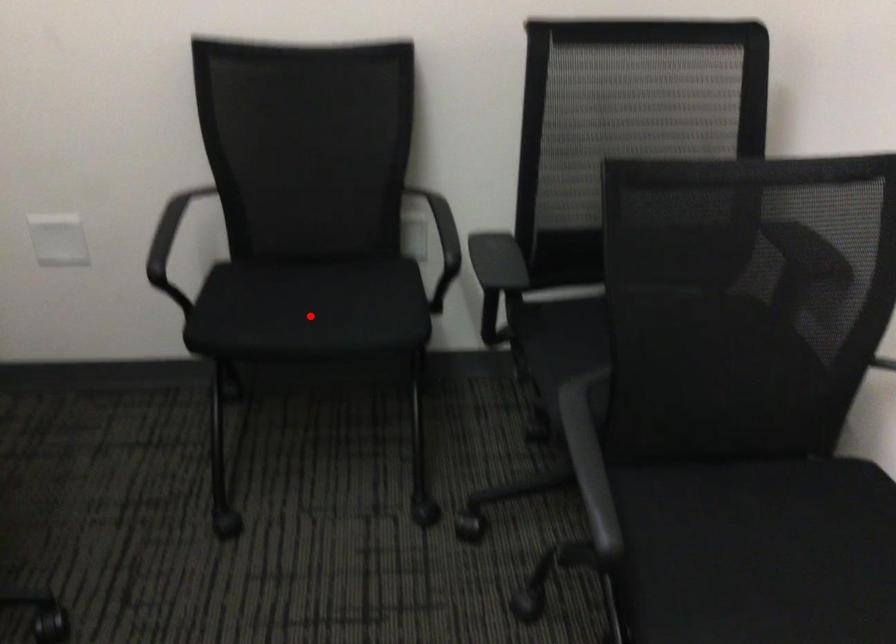
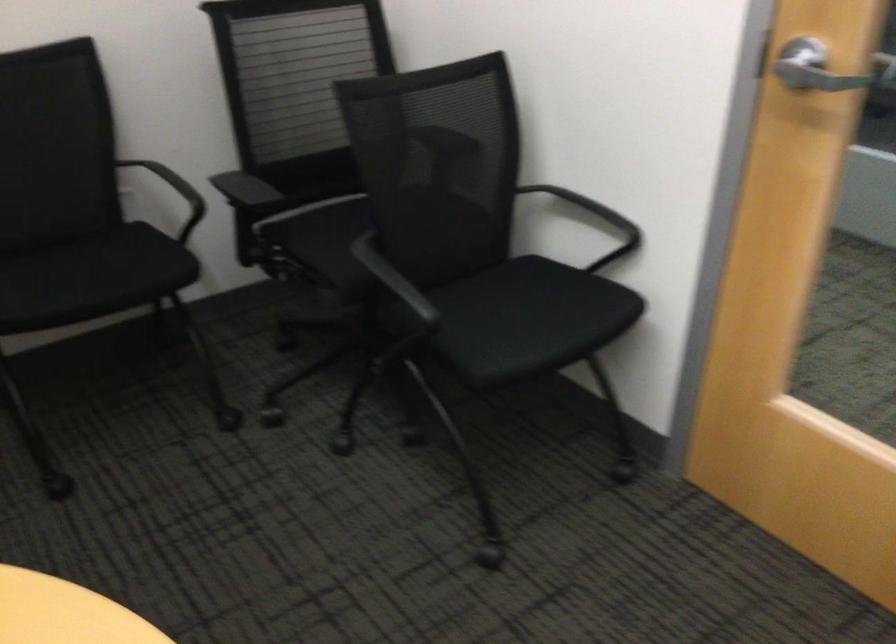
Question: I am providing you with two images of the same scene from different viewpoints. A red point is shown in image1. For the corresponding object point in image2, is it positioned nearer or farther from the camera?

Choices:
 (A) Nearer
 (B) Farther

Answer: (B)